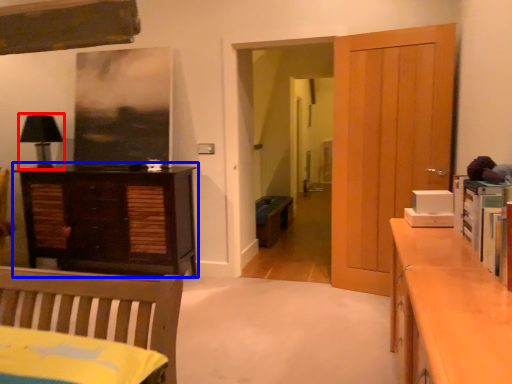
Question: Which point is closer to the camera, lamp (highlighted by a red box) or chest of drawers (highlighted by a blue box)?

Choices:
 (A) lamp
 (B) chest of drawers

Answer: (B)